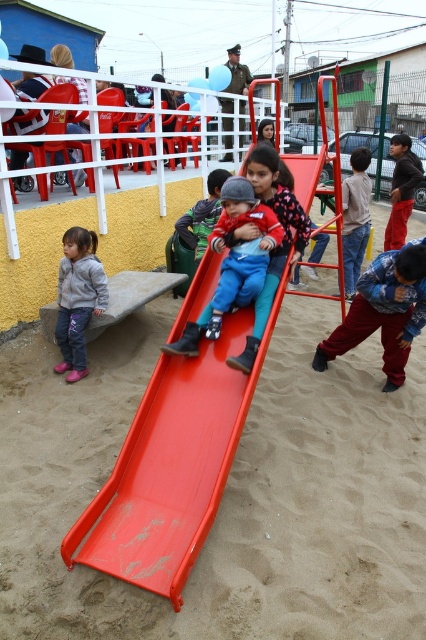
You are standing at the point marked as point (43,545) in the playground scene. If you want to observe the entire play area clearly, would your current position allow you to see all the structures and people around? Please explain based on the distance from the viewer.

The distance of point (43,545) from viewer is 9.11 feet. Being at this point places you 9.11 feet away from the viewer perspective, which might limit your ability to see distant structures like the yellow wall with white railing or the red plastic chairs in the background clearly. However, closer structures like the red slide and the children sliding would be visible.

You are a parent watching your child play at the playground. You notice the smooth plastic slide at center and the smooth blue pants at center. Which object is bigger in size?

The smooth plastic slide at center is larger in size compared to the smooth blue pants at center.